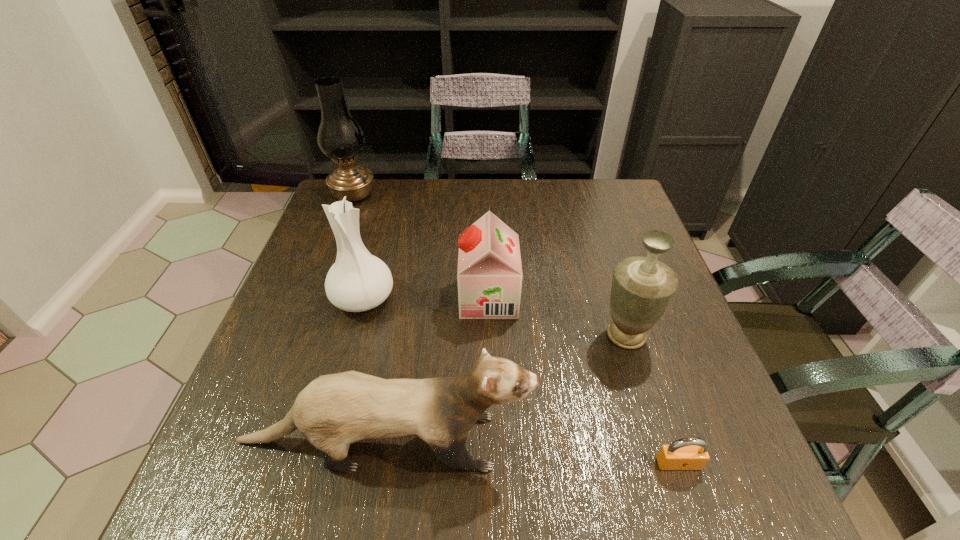
Find the location of a particular element. vacant area in the image that satisfies the following two spatial constraints: 1. on the front side of the farthest object; 2. on the left side of the urn is located at coordinates (300, 335).

Find the location of a particular element. The width and height of the screenshot is (960, 540). free space that satisfies the following two spatial constraints: 1. on the front side of the vase; 2. on the right side of the tallest object is located at coordinates (313, 298).